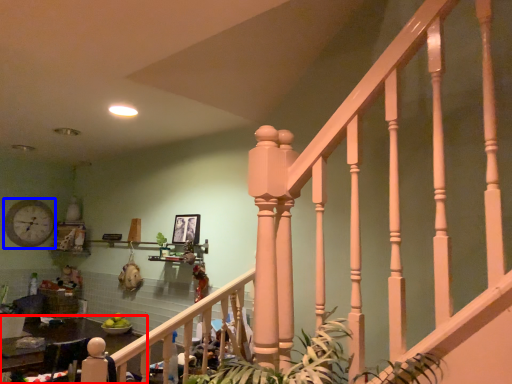
Question: Among these objects, which one is farthest to the camera, table (highlighted by a red box) or clock (highlighted by a blue box)?

Choices:
 (A) table
 (B) clock

Answer: (B)